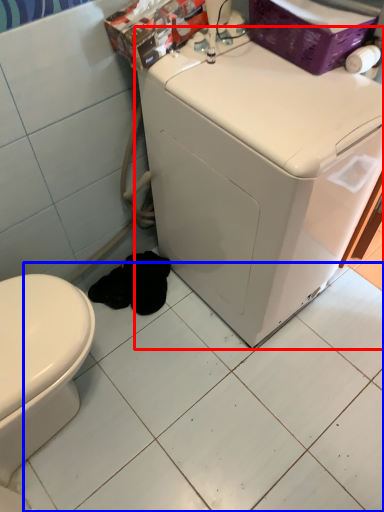
Question: Which object appears farthest to the camera in this image, washing machine (highlighted by a red box) or ceramic tile (highlighted by a blue box)?

Choices:
 (A) washing machine
 (B) ceramic tile

Answer: (B)